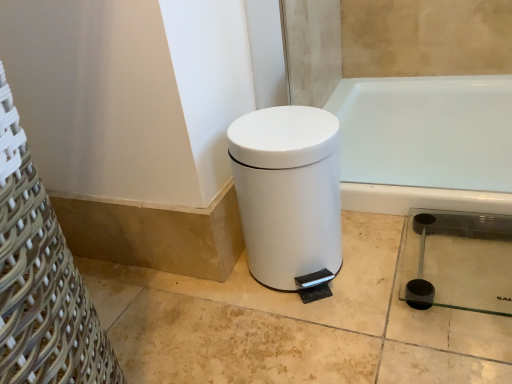
Where is `free space in front of white matte waste container at lower center`? The height and width of the screenshot is (384, 512). free space in front of white matte waste container at lower center is located at coordinates (327, 339).